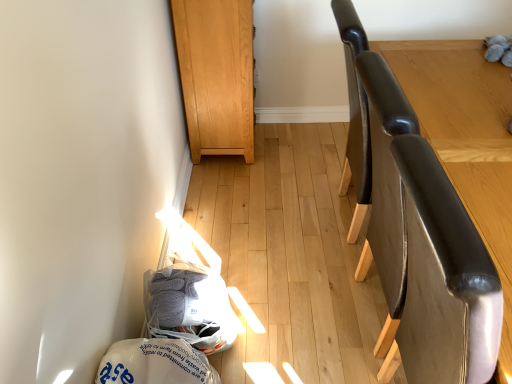
Question: Can you confirm if light brown wood cabinet at upper center is taller than leather-like brown swivel chair at right?

Choices:
 (A) no
 (B) yes

Answer: (A)

Question: Can you confirm if light brown wood cabinet at upper center is wider than leather-like brown swivel chair at right?

Choices:
 (A) yes
 (B) no

Answer: (B)

Question: Does light brown wood cabinet at upper center contain leather-like brown swivel chair at right?

Choices:
 (A) no
 (B) yes

Answer: (A)

Question: Would you say light brown wood cabinet at upper center is a long distance from leather-like brown swivel chair at right?

Choices:
 (A) no
 (B) yes

Answer: (B)

Question: Is light brown wood cabinet at upper center oriented away from leather-like brown swivel chair at right?

Choices:
 (A) no
 (B) yes

Answer: (A)

Question: Is gray yarn at lower left, which is counted as the 2th material, starting from the bottom, wider or thinner than glossy leather chair at right?

Choices:
 (A) thin
 (B) wide

Answer: (A)

Question: From the image's perspective, is gray yarn at lower left, which is the 1th material from top to bottom, above or below glossy leather chair at right?

Choices:
 (A) above
 (B) below

Answer: (B)

Question: Is gray yarn at lower left, which is counted as the 2th material, starting from the bottom, in front of or behind glossy leather chair at right in the image?

Choices:
 (A) behind
 (B) front

Answer: (A)

Question: Is point (202, 269) closer or farther from the camera than point (374, 251)?

Choices:
 (A) farther
 (B) closer

Answer: (A)

Question: Considering the positions of white plastic bag at lower left, which appears as the 1th material when ordered from the bottom, and light brown wood cabinet at upper center in the image, is white plastic bag at lower left, which appears as the 1th material when ordered from the bottom, taller or shorter than light brown wood cabinet at upper center?

Choices:
 (A) short
 (B) tall

Answer: (A)

Question: Considering the positions of white plastic bag at lower left, which appears as the 1th material when ordered from the bottom, and light brown wood cabinet at upper center in the image, is white plastic bag at lower left, which appears as the 1th material when ordered from the bottom, wider or thinner than light brown wood cabinet at upper center?

Choices:
 (A) thin
 (B) wide

Answer: (A)

Question: Is white plastic bag at lower left, marked as the second material in a top-to-bottom arrangement, spatially inside light brown wood cabinet at upper center, or outside of it?

Choices:
 (A) inside
 (B) outside

Answer: (B)

Question: Is point (128, 370) positioned closer to the camera than point (240, 97)?

Choices:
 (A) closer
 (B) farther

Answer: (A)

Question: From the image's perspective, is glossy leather chair at right located above or below leather-like brown swivel chair at right?

Choices:
 (A) above
 (B) below

Answer: (A)

Question: Based on their sizes in the image, would you say glossy leather chair at right is bigger or smaller than leather-like brown swivel chair at right?

Choices:
 (A) small
 (B) big

Answer: (B)